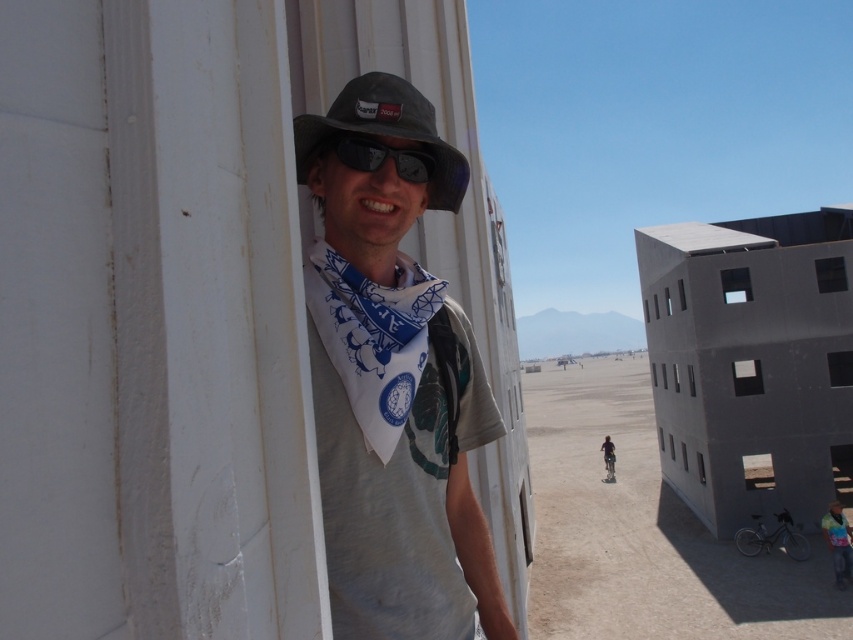
Based on the photo, you are trying to decide whether to place a small sticker on either the black reflective sunglasses at center or the matte gray shirt at center. The sticker is 3 centimeters wide. Which object can the sticker fit on without exceeding its width?

The matte gray shirt at center has a greater width than the black reflective sunglasses at center, so the sticker can fit on the matte gray shirt at center.

You are a photographer trying to capture the person in the scene. You notice the white cotton bandana at center and the matte gray shirt at center. Which item would you focus on if you want to highlight something narrow in your photo?

The white cotton bandana at center is thinner than the matte gray shirt at center, so focusing on the white cotton bandana at center would highlight a narrow item in the photo.

You are a photographer trying to capture the person in the scene. If you want to focus on the matte black hat at center without the white printed scarf at center blocking it, which direction should you move your camera? Please explain your reasoning based on their positions.

The matte black hat at center is behind the white printed scarf at center. To avoid the scarf blocking the hat, you should move the camera slightly forward or adjust the angle to position the hat in front of the scarf. Alternatively, moving the camera to the side might allow you to reposition the hat relative to the scarf, ensuring it isn